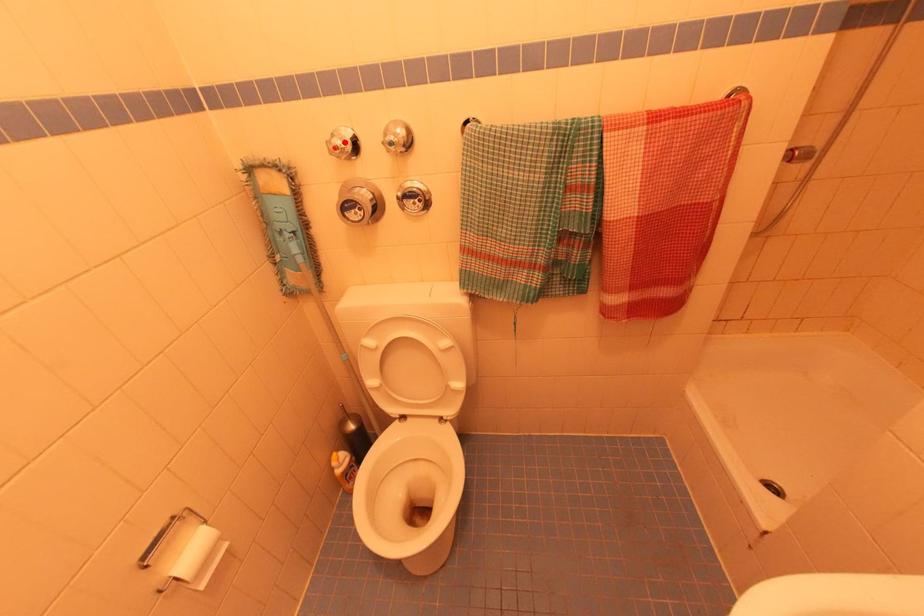
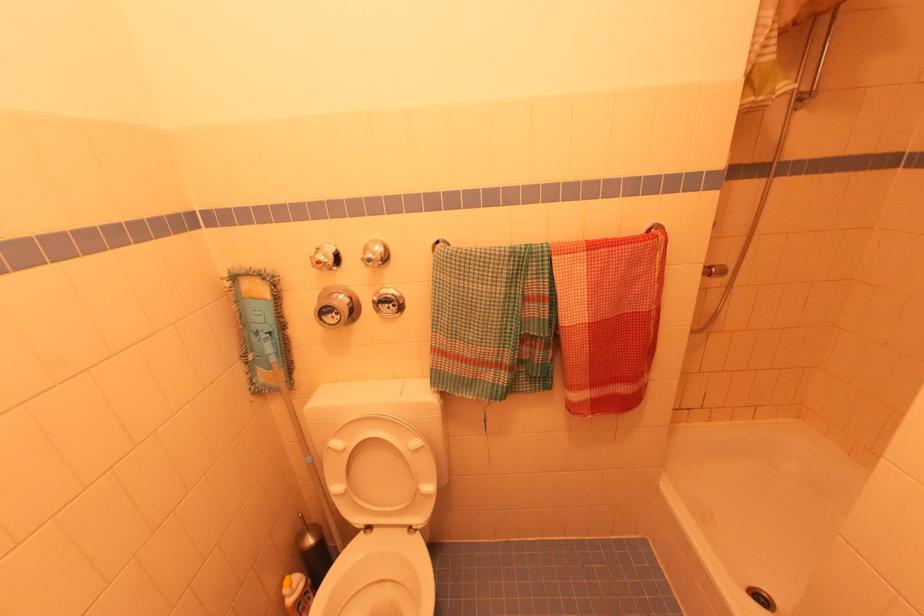
Find the pixel in the second image that matches the highlighted location in the first image.

(327, 257)